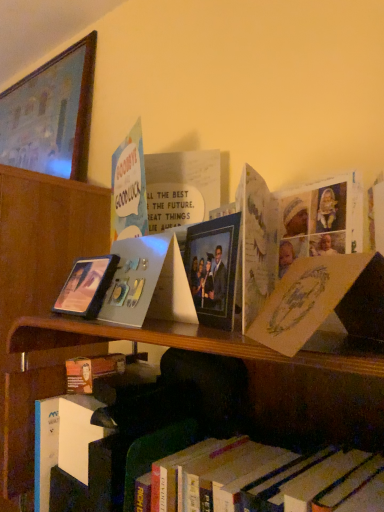
Question: Is yellow paper at upper right, arranged as the 2th paperback book when viewed from the left, facing away from wooden picture frame at upper left, the third picture frame in the right-to-left sequence?

Choices:
 (A) no
 (B) yes

Answer: (A)

Question: Does yellow paper at upper right, arranged as the 2th paperback book when viewed from the left, have a smaller size compared to wooden picture frame at upper left, marked as the third picture frame in a front-to-back arrangement?

Choices:
 (A) no
 (B) yes

Answer: (B)

Question: From the image's perspective, would you say yellow paper at upper right, the second paperback book in the back-to-front sequence, is positioned over wooden picture frame at upper left, marked as the third picture frame in a front-to-back arrangement?

Choices:
 (A) yes
 (B) no

Answer: (B)

Question: From a real-world perspective, is yellow paper at upper right, the second paperback book in the back-to-front sequence, located higher than wooden picture frame at upper left, which appears as the 1th picture frame when viewed from the left?

Choices:
 (A) no
 (B) yes

Answer: (A)

Question: From the image's perspective, does yellow paper at upper right, placed as the 1th paperback book when sorted from front to back, appear lower than wooden picture frame at upper left, which is the 3th picture frame in bottom-to-top order?

Choices:
 (A) no
 (B) yes

Answer: (B)

Question: Is yellow paper at upper right, placed as the 1th paperback book when sorted from front to back, wider than wooden picture frame at upper left, which is the 3th picture frame in bottom-to-top order?

Choices:
 (A) yes
 (B) no

Answer: (A)

Question: Is matte silver photo album at center, marked as the 2th paperback book in a right-to-left arrangement, closer to camera compared to wooden picture frame at upper left, the third picture frame in the right-to-left sequence?

Choices:
 (A) yes
 (B) no

Answer: (A)

Question: From the image's perspective, is matte silver photo album at center, which is counted as the first paperback book, starting from the left, below wooden picture frame at upper left, marked as the third picture frame in a front-to-back arrangement?

Choices:
 (A) yes
 (B) no

Answer: (A)

Question: Is matte silver photo album at center, which ranks as the 2th paperback book in front-to-back order, placed right next to wooden picture frame at upper left, marked as the third picture frame in a front-to-back arrangement?

Choices:
 (A) no
 (B) yes

Answer: (A)

Question: From the image's perspective, is matte silver photo album at center, the first paperback book when ordered from back to front, over wooden picture frame at upper left, which ranks as the 1th picture frame in back-to-front order?

Choices:
 (A) no
 (B) yes

Answer: (A)

Question: Considering the relative sizes of matte silver photo album at center, marked as the 2th paperback book in a right-to-left arrangement, and wooden picture frame at upper left, marked as the 1th picture frame in a top-to-bottom arrangement, in the image provided, is matte silver photo album at center, marked as the 2th paperback book in a right-to-left arrangement, thinner than wooden picture frame at upper left, marked as the 1th picture frame in a top-to-bottom arrangement,?

Choices:
 (A) yes
 (B) no

Answer: (A)

Question: Does matte silver photo album at center, marked as the 2th paperback book in a right-to-left arrangement, have a greater height compared to wooden picture frame at upper left, which ranks as the 1th picture frame in back-to-front order?

Choices:
 (A) no
 (B) yes

Answer: (A)

Question: Is wooden picture frame at upper left, the third picture frame in the right-to-left sequence, outside of pastel paper card at upper left?

Choices:
 (A) yes
 (B) no

Answer: (A)